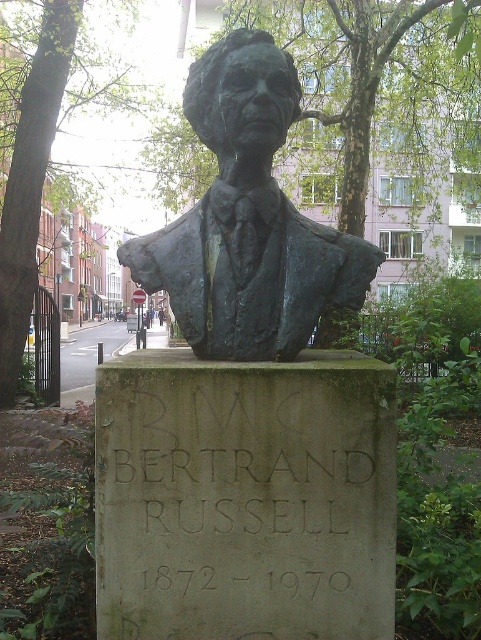
Can you confirm if bronze statue at center is bigger than graycarved stonebust at center?

Yes.

Does bronze statue at center appear on the right side of graycarved stonebust at center?

No, bronze statue at center is not to the right of graycarved stonebust at center.

Identify the location of bronze statue at center. pyautogui.click(x=248, y=220).

This screenshot has width=481, height=640. I want to click on bronze statue at center, so click(x=248, y=220).